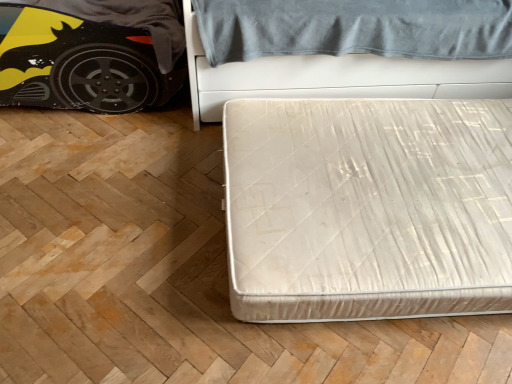
Question: Considering the relative positions of white textured mattress at center, which is counted as the first bed, starting from the top, and white fabric mattress at lower right, which is the second bed in top-to-bottom order, in the image provided, is white textured mattress at center, which is counted as the first bed, starting from the top, to the left of white fabric mattress at lower right, which is the second bed in top-to-bottom order, from the viewer's perspective?

Choices:
 (A) no
 (B) yes

Answer: (A)

Question: From a real-world perspective, is white textured mattress at center, acting as the second bed starting from the bottom, below white fabric mattress at lower right, acting as the 1th bed starting from the bottom?

Choices:
 (A) yes
 (B) no

Answer: (B)

Question: Considering the relative sizes of white textured mattress at center, acting as the second bed starting from the bottom, and white fabric mattress at lower right, which is the second bed in top-to-bottom order, in the image provided, is white textured mattress at center, acting as the second bed starting from the bottom, taller than white fabric mattress at lower right, which is the second bed in top-to-bottom order,?

Choices:
 (A) yes
 (B) no

Answer: (A)

Question: Is white textured mattress at center, acting as the second bed starting from the bottom, not within white fabric mattress at lower right, acting as the 1th bed starting from the bottom?

Choices:
 (A) no
 (B) yes

Answer: (B)

Question: From the image's perspective, would you say white textured mattress at center, acting as the second bed starting from the bottom, is shown under white fabric mattress at lower right, which is the second bed in top-to-bottom order?

Choices:
 (A) no
 (B) yes

Answer: (A)

Question: Considering the positions of white fabric mattress at lower right, acting as the 1th bed starting from the bottom, and white textured mattress at center, acting as the second bed starting from the bottom, in the image, is white fabric mattress at lower right, acting as the 1th bed starting from the bottom, bigger or smaller than white textured mattress at center, acting as the second bed starting from the bottom,?

Choices:
 (A) small
 (B) big

Answer: (A)

Question: From a real-world perspective, is white fabric mattress at lower right, which is the second bed in top-to-bottom order, physically located above or below white textured mattress at center, acting as the second bed starting from the bottom?

Choices:
 (A) above
 (B) below

Answer: (B)

Question: Is white fabric mattress at lower right, which is the second bed in top-to-bottom order, taller or shorter than white textured mattress at center, which is counted as the first bed, starting from the top?

Choices:
 (A) short
 (B) tall

Answer: (A)

Question: Is white fabric mattress at lower right, which is the second bed in top-to-bottom order, wider or thinner than white textured mattress at center, acting as the second bed starting from the bottom?

Choices:
 (A) thin
 (B) wide

Answer: (B)

Question: In terms of height, does matt black car at left look taller or shorter compared to white fabric mattress at lower right, acting as the 1th bed starting from the bottom?

Choices:
 (A) tall
 (B) short

Answer: (A)

Question: Based on their sizes in the image, would you say matt black car at left is bigger or smaller than white fabric mattress at lower right, which is the second bed in top-to-bottom order?

Choices:
 (A) small
 (B) big

Answer: (B)

Question: Is matt black car at left to the left or to the right of white fabric mattress at lower right, acting as the 1th bed starting from the bottom, in the image?

Choices:
 (A) right
 (B) left

Answer: (B)

Question: Would you say matt black car at left is inside or outside white fabric mattress at lower right, acting as the 1th bed starting from the bottom?

Choices:
 (A) outside
 (B) inside

Answer: (A)

Question: Is white fabric mattress at lower right, acting as the 1th bed starting from the bottom, wider or thinner than matt black car at left?

Choices:
 (A) wide
 (B) thin

Answer: (A)

Question: Looking at the image, does white fabric mattress at lower right, acting as the 1th bed starting from the bottom, seem bigger or smaller compared to matt black car at left?

Choices:
 (A) big
 (B) small

Answer: (B)